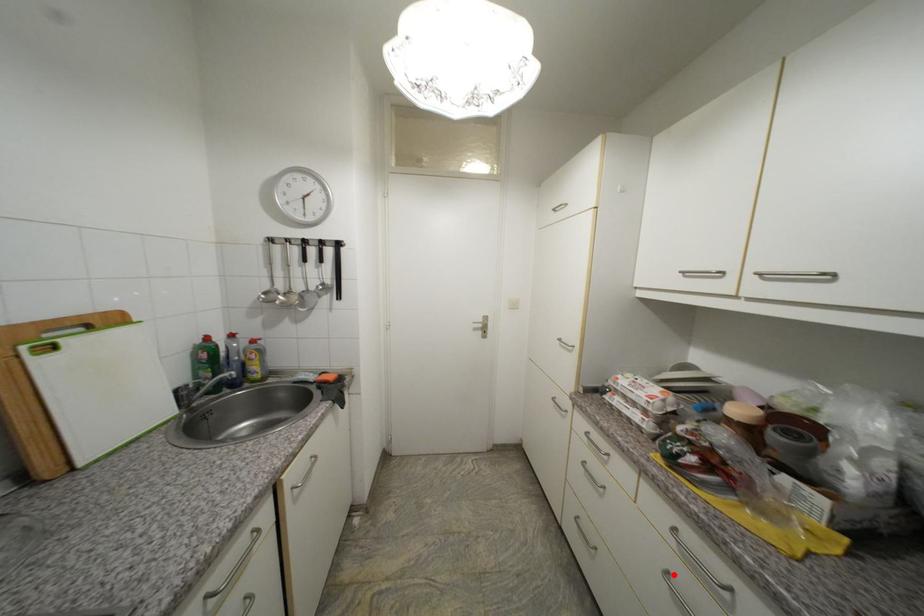
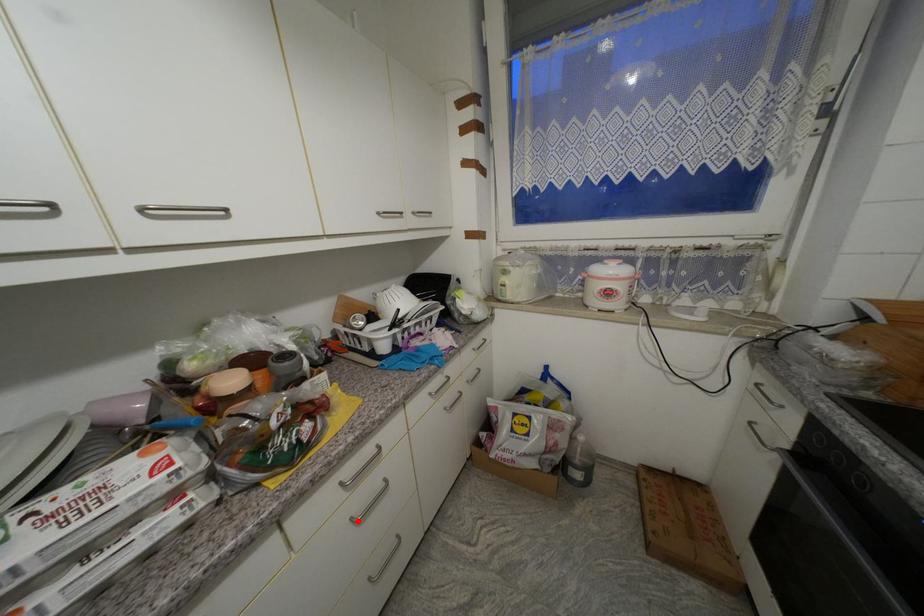
I am providing you with two images of the same scene from different viewpoints. A red point is marked on the first image and another point is marked on the second image. Are the points marked in image1 and image2 representing the same 3D position?

Yes